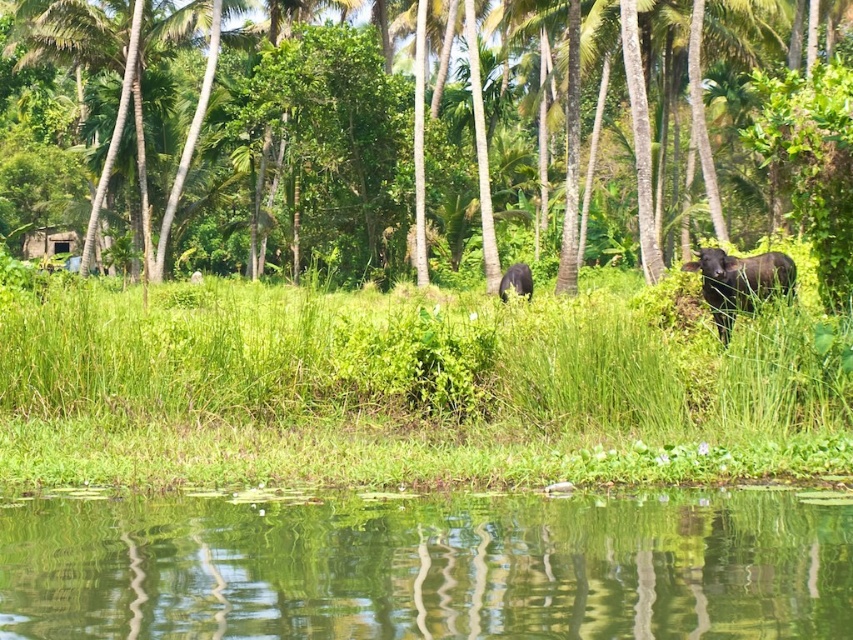
Question: Which object is closer to the camera taking this photo?

Choices:
 (A) black matte cow at right
 (B) green reflective water at lower center
 (C) green grass at center
 (D) green leafy tree at center

Answer: (B)

Question: Based on their relative distances, which object is farther from the green grass at center?

Choices:
 (A) black matte cow at right
 (B) black matte cow at center
 (C) green leafy tree at center
 (D) green reflective water at lower center

Answer: (C)

Question: Is green grass at center positioned before black matte cow at center?

Choices:
 (A) yes
 (B) no

Answer: (A)

Question: Can you confirm if green grass at center is positioned above green reflective water at lower center?

Choices:
 (A) yes
 (B) no

Answer: (A)

Question: Can you confirm if green grass at center is wider than black matte cow at right?

Choices:
 (A) yes
 (B) no

Answer: (A)

Question: Which point appears closest to the camera in this image?

Choices:
 (A) (236, 84)
 (B) (683, 444)
 (C) (505, 280)
 (D) (167, 579)

Answer: (D)